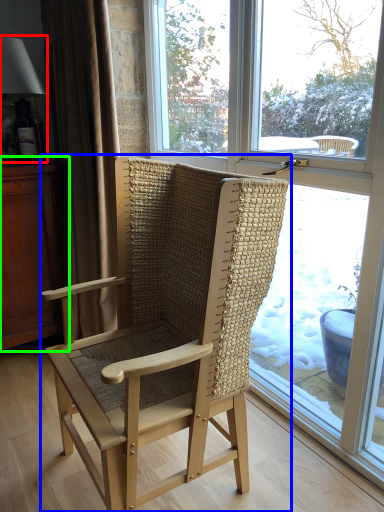
Question: Based on their relative distances, which object is farther from lamp (highlighted by a red box)? Choose from chair (highlighted by a blue box) and dresser (highlighted by a green box).

Choices:
 (A) chair
 (B) dresser

Answer: (A)